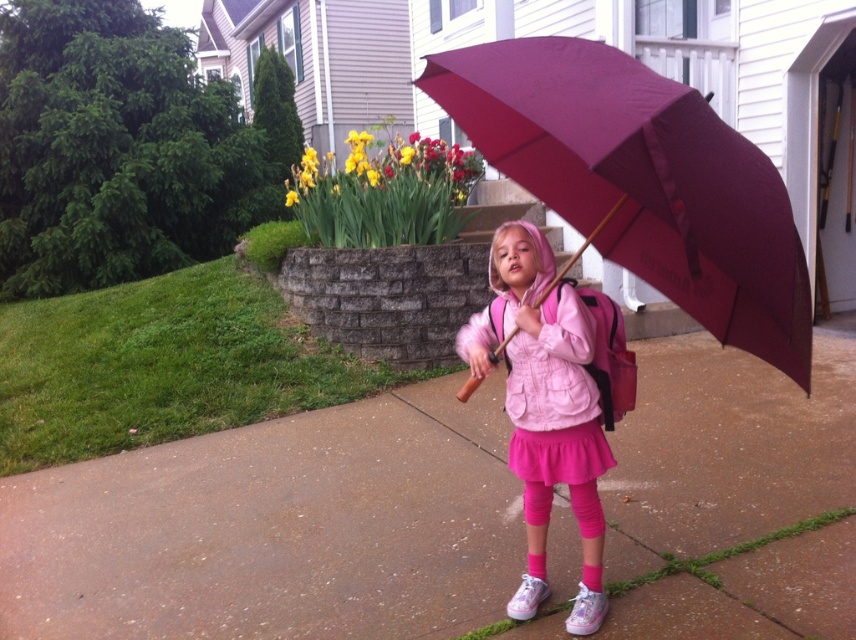
Question: Based on their relative distances, which object is nearer to the burgundy fabric umbrella at center?

Choices:
 (A) smooth concrete pavement at center
 (B) pink fleece jacket at center

Answer: (B)

Question: Can you confirm if smooth concrete pavement at center is thinner than burgundy fabric umbrella at center?

Choices:
 (A) yes
 (B) no

Answer: (B)

Question: Which of the following is the closest to the observer?

Choices:
 (A) burgundy fabric umbrella at center
 (B) pink fleece jacket at center
 (C) smooth concrete pavement at center
 (D) yellow matte daffodil at upper center

Answer: (A)

Question: Considering the real-world distances, which object is closest to the smooth concrete pavement at center?

Choices:
 (A) yellow matte daffodil at upper center
 (B) pink fleece jacket at center

Answer: (B)

Question: Considering the relative positions of smooth concrete pavement at center and yellow matte daffodil at upper center in the image provided, where is smooth concrete pavement at center located with respect to yellow matte daffodil at upper center?

Choices:
 (A) right
 (B) left

Answer: (B)

Question: Is smooth concrete pavement at center behind burgundy fabric umbrella at center?

Choices:
 (A) yes
 (B) no

Answer: (A)